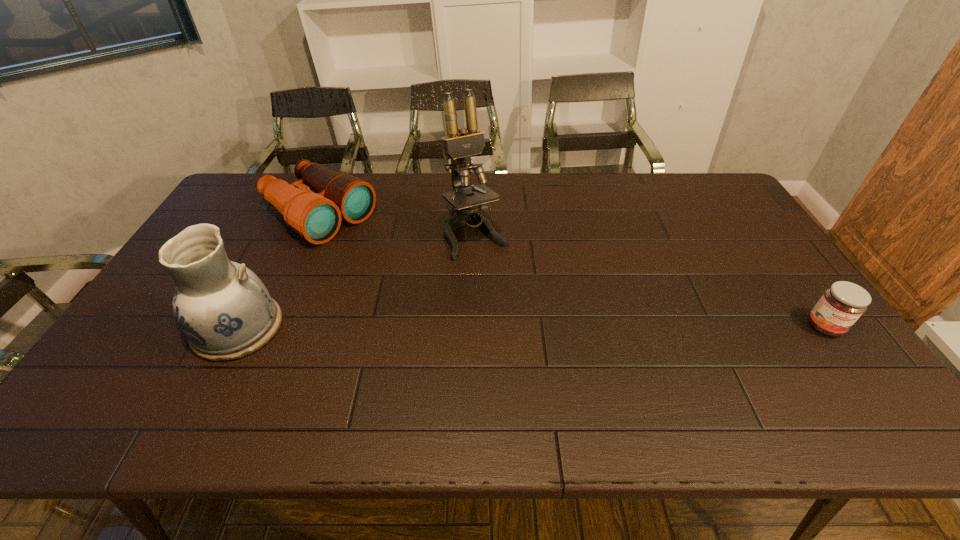
I want to click on object that is at the near left corner, so click(223, 308).

Locate an element on the screen. This screenshot has height=540, width=960. blank space at the far edge of the desktop is located at coordinates (422, 186).

In the image, there is a desktop. Identify the location of vacant space at the near edge. (638, 367).

In the image, there is a desktop. Where is `free space at the right edge`? free space at the right edge is located at coordinates (751, 265).

I want to click on vacant area at the near right corner, so click(x=826, y=354).

At what (x,y) coordinates should I click in order to perform the action: click on free spot between the tallest object and the second tallest object. Please return your answer as a coordinate pair (x, y). The height and width of the screenshot is (540, 960). Looking at the image, I should click on click(356, 281).

The width and height of the screenshot is (960, 540). Identify the location of empty space between the microscope and the pottery. (356, 281).

Where is `free area in between the third shortest object and the jam`? The height and width of the screenshot is (540, 960). free area in between the third shortest object and the jam is located at coordinates (531, 327).

You are a GUI agent. You are given a task and a screenshot of the screen. Output one action in this format:
    pyautogui.click(x=<x>, y=<y>)
    Task: Click on the free space between the tallest object and the binoculars
    
    Given the screenshot: What is the action you would take?
    pyautogui.click(x=397, y=225)

Locate an element on the screen. free space that is in between the second shortest object and the tallest object is located at coordinates (397, 225).